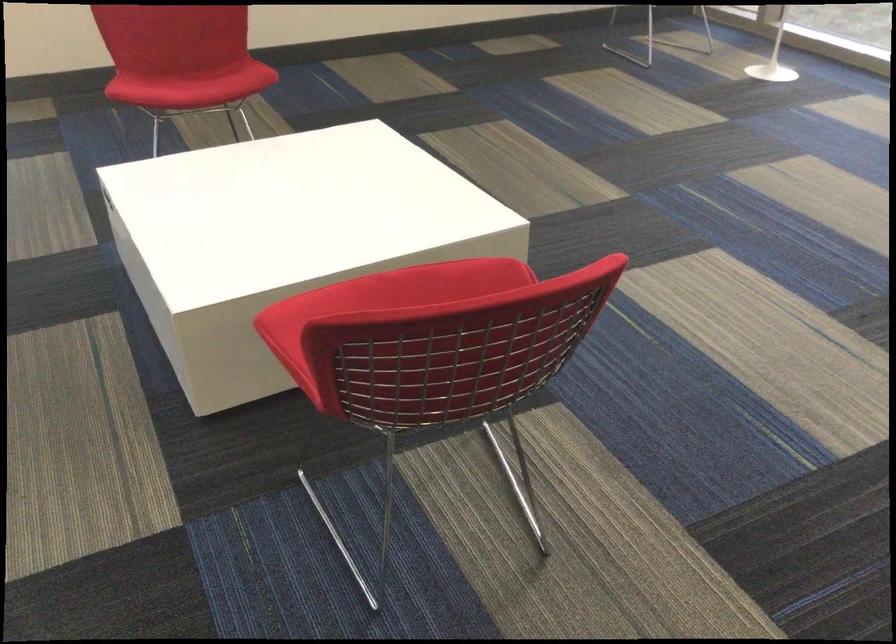
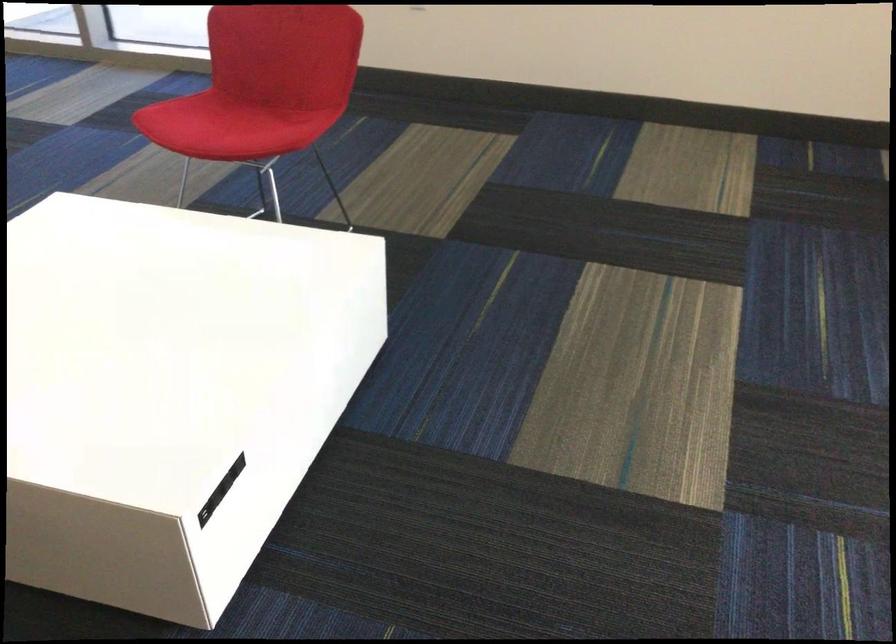
In the second image, find the point that corresponds to point (168, 90) in the first image.

(225, 124)